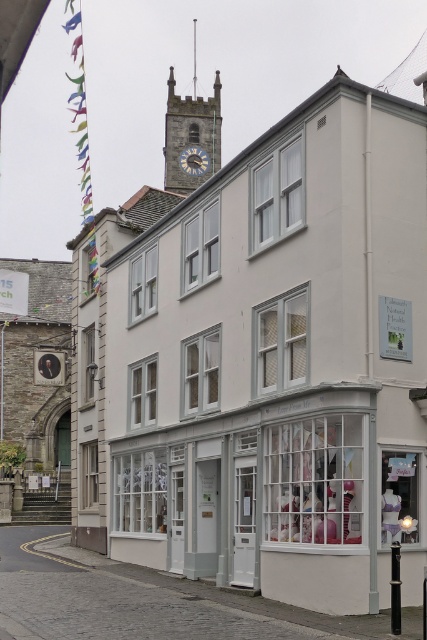
Question: Does matte gray stone clock tower at upper center come behind metallic clock face at center?

Choices:
 (A) yes
 (B) no

Answer: (B)

Question: Which point is farther to the camera?

Choices:
 (A) (201, 118)
 (B) (190, 173)

Answer: (A)

Question: Is matte gray stone clock tower at upper center below metallic clock face at center?

Choices:
 (A) yes
 (B) no

Answer: (B)

Question: Does matte gray stone clock tower at upper center have a larger size compared to metallic clock face at center?

Choices:
 (A) no
 (B) yes

Answer: (B)

Question: Which point appears closest to the camera in this image?

Choices:
 (A) (193, 145)
 (B) (199, 109)

Answer: (A)

Question: Among these points, which one is nearest to the camera?

Choices:
 (A) (186, 156)
 (B) (166, 168)

Answer: (B)